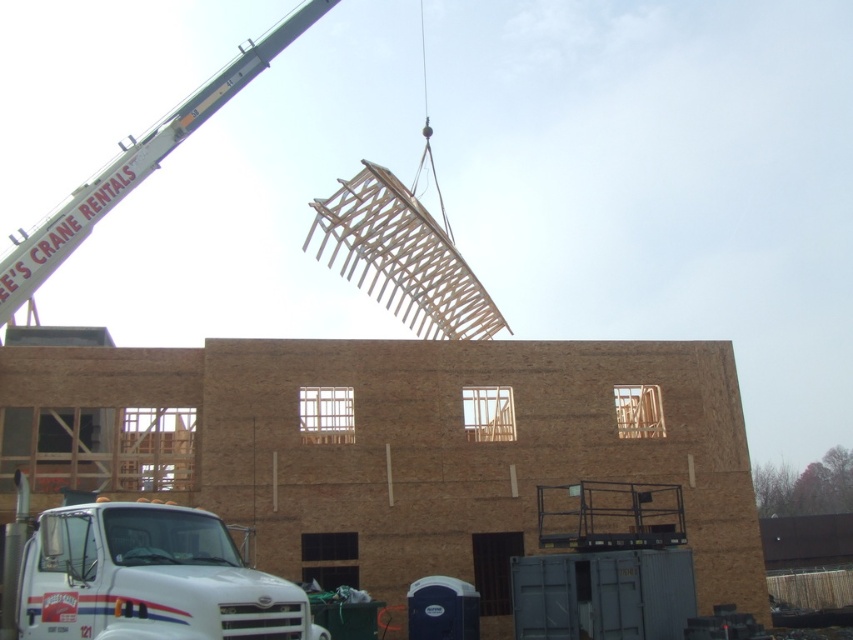
You are a safety inspector at the construction site. You need to ensure that the white glossy truck at lower left and the white painted metal crane at upper left are visible to each other for communication. Given their sizes, which one is more likely to block the other from view?

The white painted metal crane at upper left is larger than the white glossy truck at lower left. Therefore, the crane could potentially block the truck from view depending on their positions, but since the truck is smaller, it might be more easily visible around or under the crane.

You are a delivery driver who needs to park your white glossy truck at lower left next to the white painted metal crane at upper left. Can you park it there without overlapping?

The white glossy truck at lower left is narrower than the white painted metal crane at upper left, so yes, you can park it there without overlapping.

You are standing at the point labeled point (144, 579) in the construction site. What object is located at this point? Please answer with the object name exactly as it appears in the objects list.

The point (144, 579) corresponds to the white glossy truck at lower left.